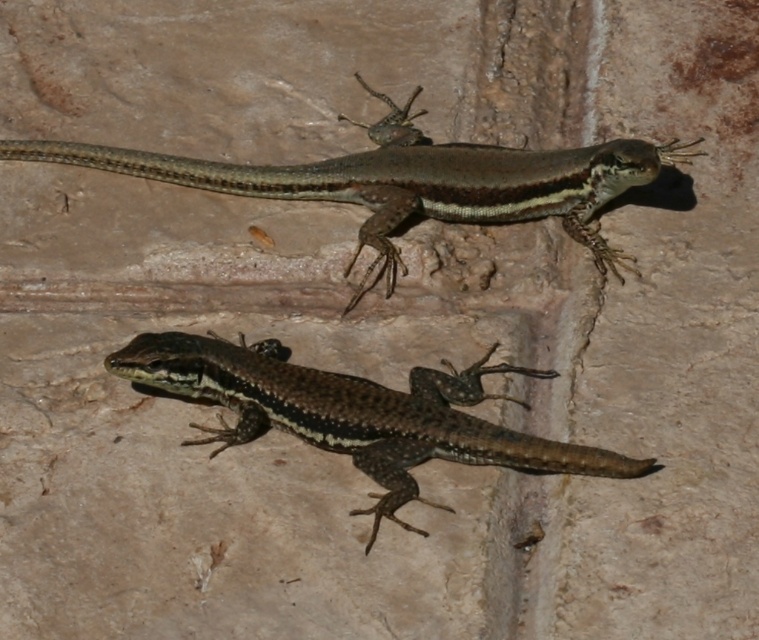
Consider the image. You are standing in front of the textured wall where the two lizards are positioned. You notice a specific point marked at coordinates (411,180). Which lizard is located at this point?

The point at coordinates (411,180) corresponds to the brown matte lizard at upper center.

You are a small insect observing the two lizards in the image. Which lizard is closer to you, the brown matte lizard at upper center or the brown scaly lizard at center?

The brown matte lizard at upper center is closer to you because the brown scaly lizard at center is positioned behind it.

You are a small insect on the textured surface. You want to move from the brown matte lizard at upper center to the brown scaly lizard at center without getting too close to either. What is the minimum distance you need to maintain from each lizard to stay safe?

The minimum distance you need to maintain from each lizard is half of the distance between them, which is 4.34 inches, to stay equidistant and safe from both the brown matte lizard at upper center and the brown scaly lizard at center.